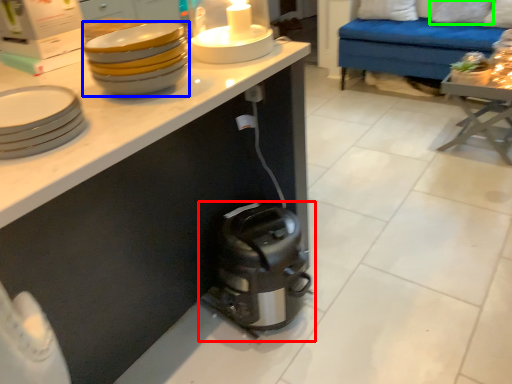
Question: Which is farther away from home appliance (highlighted by a red box)? tableware (highlighted by a blue box) or pillow (highlighted by a green box)?

Choices:
 (A) tableware
 (B) pillow

Answer: (B)